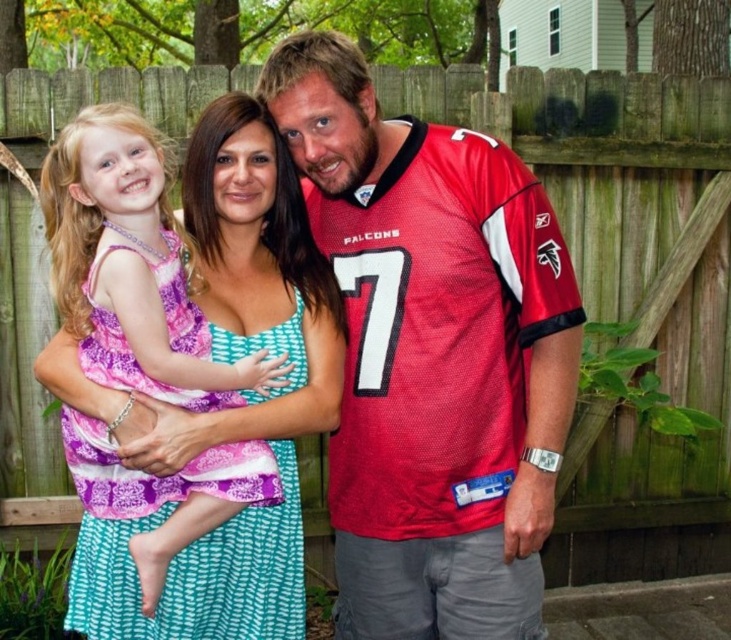
Question: Is the position of red jersey at center less distant than that of purple printed fabric dress at center?

Choices:
 (A) yes
 (B) no

Answer: (B)

Question: Is red jersey at center positioned at the back of purple printed fabric dress at center?

Choices:
 (A) no
 (B) yes

Answer: (B)

Question: Among these points, which one is farthest from the camera?

Choices:
 (A) (132, 355)
 (B) (447, 166)

Answer: (B)

Question: Which point is farther to the camera?

Choices:
 (A) (511, 500)
 (B) (96, 637)

Answer: (A)

Question: Can you confirm if red jersey at center is positioned above purple printed fabric dress at center?

Choices:
 (A) yes
 (B) no

Answer: (A)